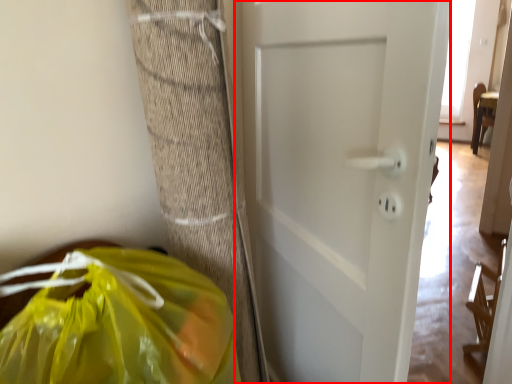
Question: Considering the relative positions of door (annotated by the red box) and plastic bag in the image provided, where is door (annotated by the red box) located with respect to the staircase?

Choices:
 (A) right
 (B) left

Answer: (A)